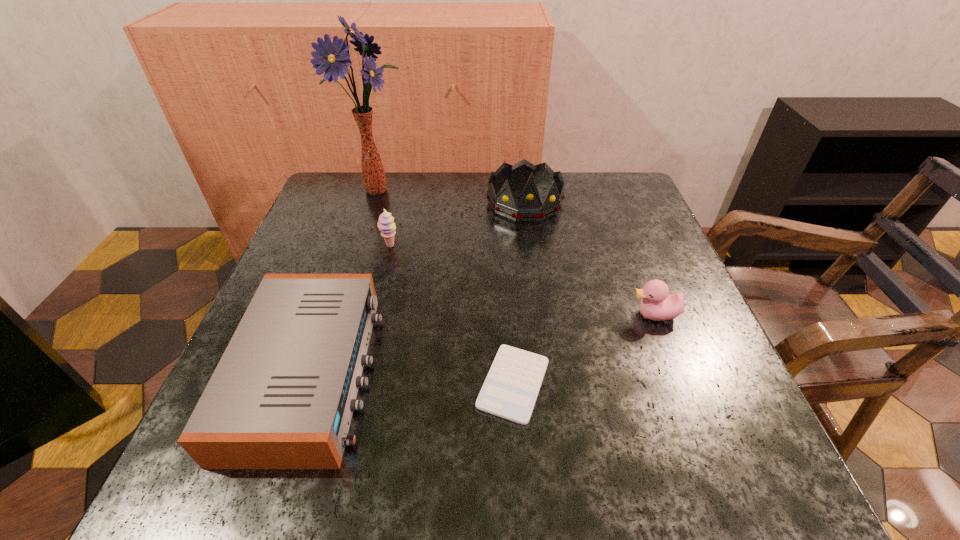
Where is `empty space between the flower arrangement and the shortest object`? The height and width of the screenshot is (540, 960). empty space between the flower arrangement and the shortest object is located at coordinates (446, 286).

Where is `free space that is in between the second tallest object and the shortest object`? free space that is in between the second tallest object and the shortest object is located at coordinates click(x=519, y=293).

Where is `free spot between the duckling and the flower arrangement`? The width and height of the screenshot is (960, 540). free spot between the duckling and the flower arrangement is located at coordinates (516, 252).

I want to click on unoccupied area between the rightmost object and the radio receiver, so click(x=482, y=344).

The image size is (960, 540). I want to click on vacant area that lies between the shortest object and the duckling, so click(584, 349).

The image size is (960, 540). Find the location of `empty location between the shortest object and the radio receiver`. empty location between the shortest object and the radio receiver is located at coordinates (411, 379).

Where is `the fourth closest object to the third farthest object`? the fourth closest object to the third farthest object is located at coordinates (510, 390).

Identify which object is the fifth closest to the sherbert. Please provide its 2D coordinates. Your answer should be formatted as a tuple, i.e. [(x, y)], where the tuple contains the x and y coordinates of a point satisfying the conditions above.

[(657, 304)]

Locate an element on the screen. free spot that satisfies the following two spatial constraints: 1. on the front-facing side of the duckling; 2. on the front side of the shortest object is located at coordinates (681, 384).